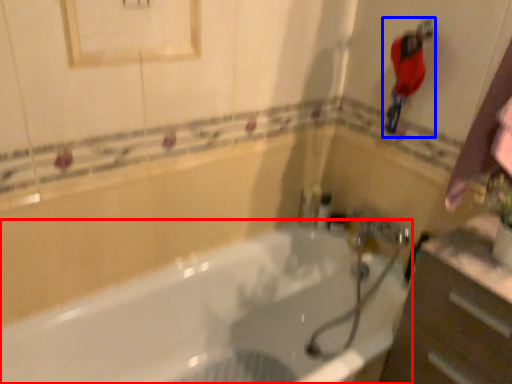
Question: Which object appears farthest to the camera in this image, bathtub (highlighted by a red box) or person (highlighted by a blue box)?

Choices:
 (A) bathtub
 (B) person

Answer: (B)